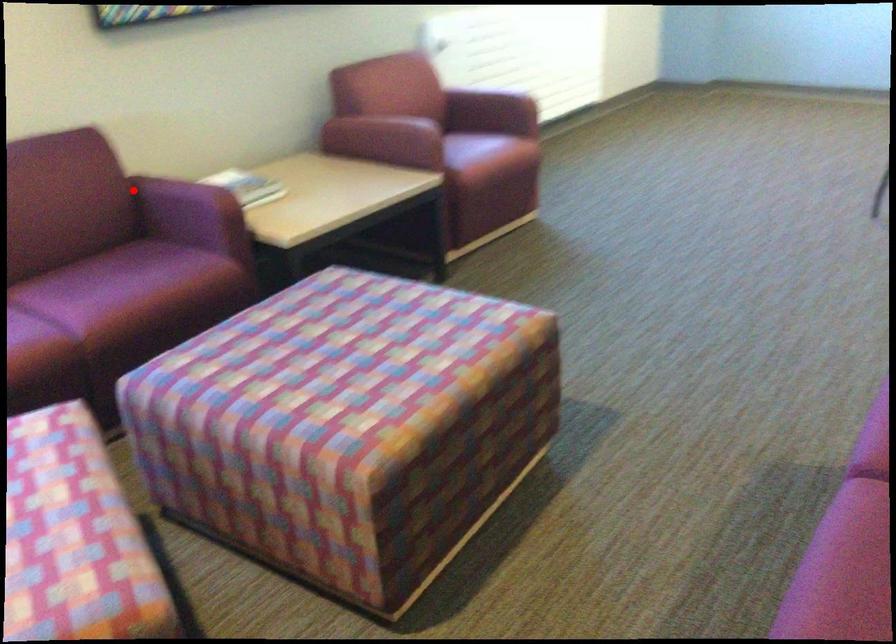
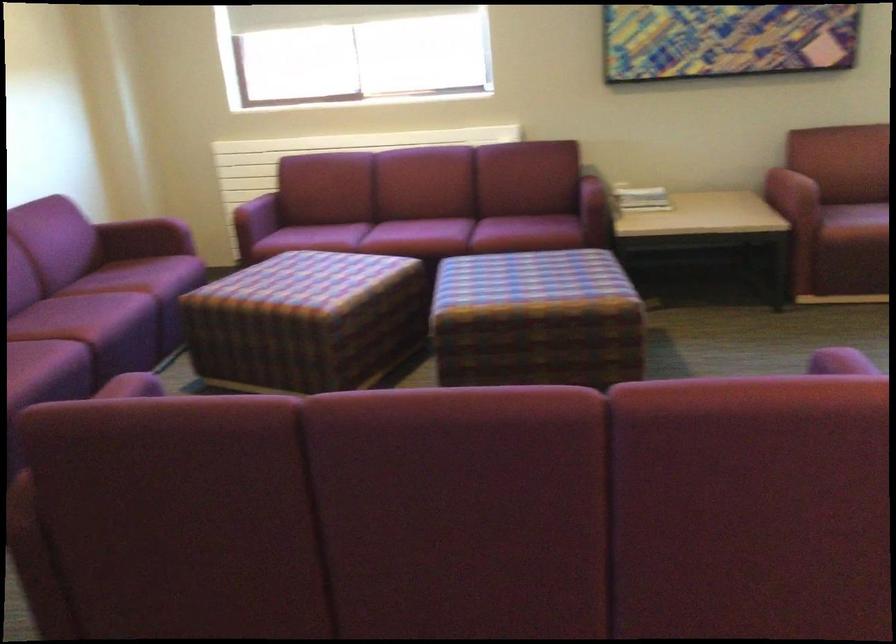
Find the pixel in the second image that matches the highlighted location in the first image.

(596, 178)